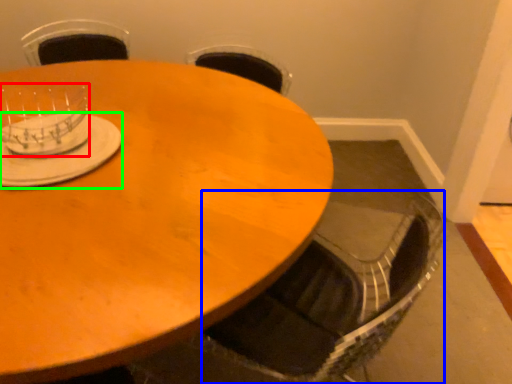
Question: Which is farther away from tableware (highlighted by a red box)? swivel chair (highlighted by a blue box) or tableware (highlighted by a green box)?

Choices:
 (A) swivel chair
 (B) tableware

Answer: (A)